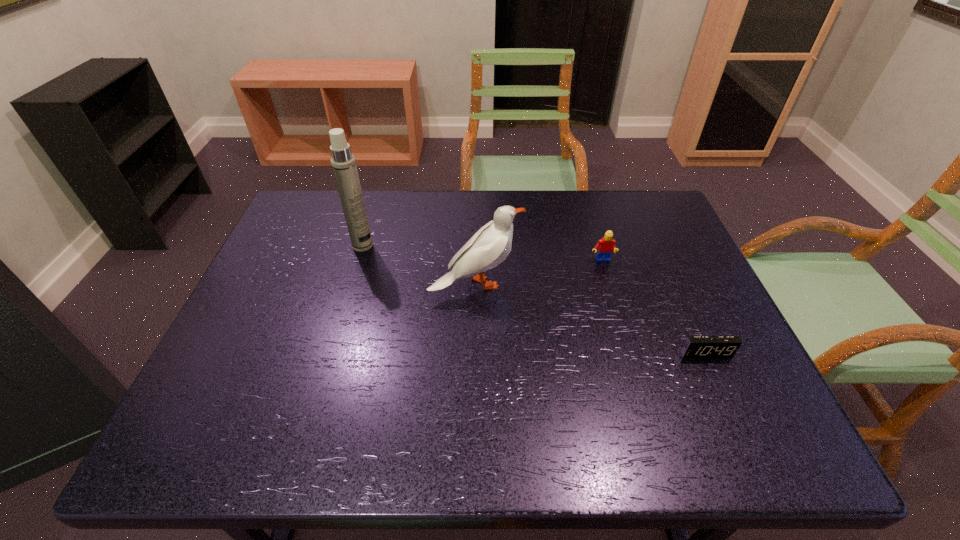
Where is `free point located on the front-facing side of the third nearest object`? This screenshot has width=960, height=540. free point located on the front-facing side of the third nearest object is located at coordinates (627, 346).

Locate an element on the screen. vacant area situated 0.100m on the front-facing side of the alarm clock is located at coordinates (726, 398).

Where is `object positioned at the right edge`? This screenshot has height=540, width=960. object positioned at the right edge is located at coordinates (695, 346).

Where is `vacant position at the far edge of the desktop`? This screenshot has height=540, width=960. vacant position at the far edge of the desktop is located at coordinates (429, 197).

Locate an element on the screen. The height and width of the screenshot is (540, 960). free space at the left edge is located at coordinates (192, 407).

Locate an element on the screen. free space at the right edge of the desktop is located at coordinates (633, 242).

In the image, there is a desktop. Identify the location of vacant region at the far left corner. (318, 206).

Locate an element on the screen. The width and height of the screenshot is (960, 540). vacant space at the near left corner of the desktop is located at coordinates (233, 447).

Locate an element on the screen. vacant space at the far right corner of the desktop is located at coordinates (643, 230).

This screenshot has height=540, width=960. Identify the location of free space at the near right corner of the desktop. (716, 454).